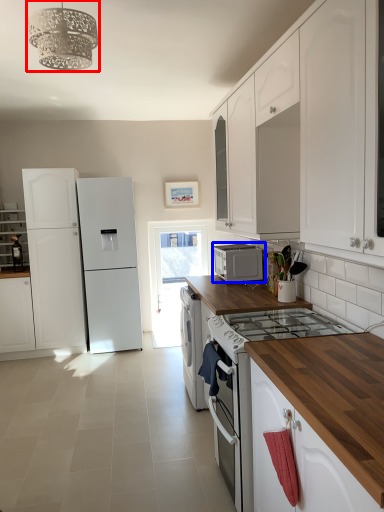
Question: Which object is closer to the camera taking this photo, light fixture (highlighted by a red box) or microwave oven (highlighted by a blue box)?

Choices:
 (A) light fixture
 (B) microwave oven

Answer: (A)